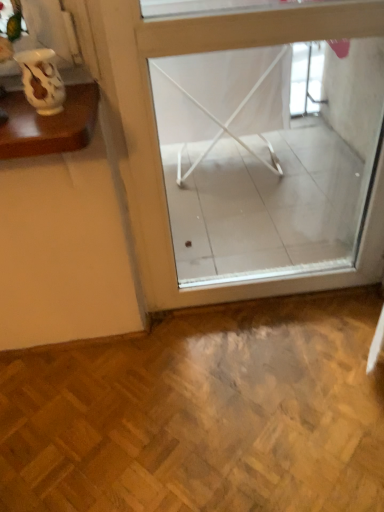
Question: Considering the positions of point (18, 56) and point (251, 25), is point (18, 56) closer or farther from the camera than point (251, 25)?

Choices:
 (A) closer
 (B) farther

Answer: (A)

Question: Would you say matte white vase at upper left is to the left or to the right of transparent glass window at center in the picture?

Choices:
 (A) right
 (B) left

Answer: (B)

Question: In the image, is matte white vase at upper left positioned in front of or behind transparent glass window at center?

Choices:
 (A) behind
 (B) front

Answer: (B)

Question: From a real-world perspective, relative to matte white vase at upper left, is transparent glass window at center vertically above or below?

Choices:
 (A) below
 (B) above

Answer: (A)

Question: Looking at their shapes, would you say transparent glass window at center is wider or thinner than matte white vase at upper left?

Choices:
 (A) thin
 (B) wide

Answer: (B)

Question: From the image's perspective, is transparent glass window at center positioned above or below matte white vase at upper left?

Choices:
 (A) above
 (B) below

Answer: (B)

Question: Would you say transparent glass window at center is to the left or to the right of matte white vase at upper left in the picture?

Choices:
 (A) left
 (B) right

Answer: (B)